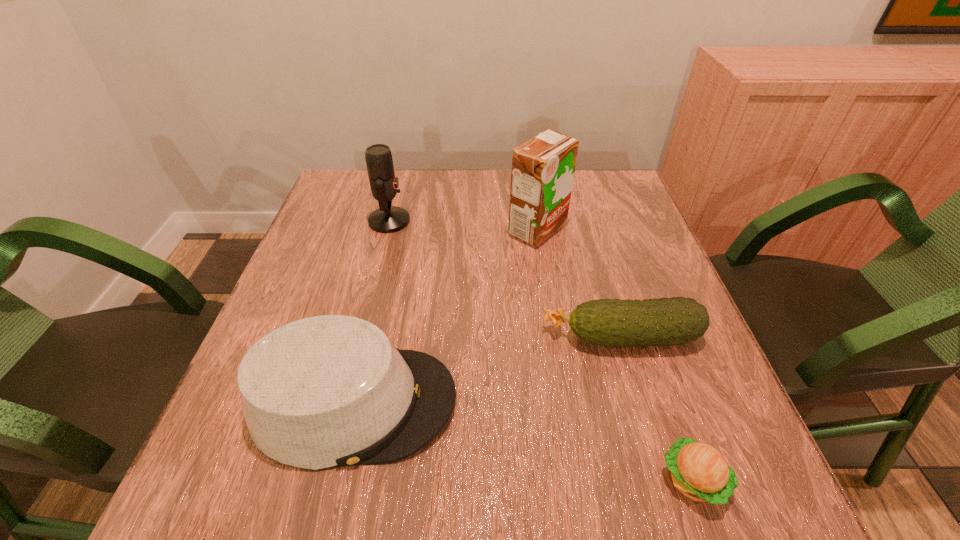
Where is `free spot between the hat and the carton`? Image resolution: width=960 pixels, height=540 pixels. free spot between the hat and the carton is located at coordinates (445, 316).

Locate an element on the screen. This screenshot has height=540, width=960. object that is the fourth closest to the third tallest object is located at coordinates (387, 219).

Locate an element on the screen. This screenshot has width=960, height=540. the third closest object to the microphone is located at coordinates coord(667,321).

Locate an element on the screen. The width and height of the screenshot is (960, 540). vacant region that satisfies the following two spatial constraints: 1. at the blossom end of the hamburger; 2. on the right side of the fourth tallest object is located at coordinates (665, 480).

Where is `free space that satisfies the following two spatial constraints: 1. on the side of the second tallest object with the red ring; 2. on the back side of the hamburger`? The height and width of the screenshot is (540, 960). free space that satisfies the following two spatial constraints: 1. on the side of the second tallest object with the red ring; 2. on the back side of the hamburger is located at coordinates (324, 480).

Image resolution: width=960 pixels, height=540 pixels. In order to click on vacant point that satisfies the following two spatial constraints: 1. on the front-facing side of the hat; 2. on the right side of the shortest object in this screenshot , I will do `click(336, 480)`.

Locate an element on the screen. free region that satisfies the following two spatial constraints: 1. on the side of the shortest object with the red ring; 2. on the left side of the fourth shortest object is located at coordinates (324, 480).

This screenshot has width=960, height=540. Find the location of `free location that satisfies the following two spatial constraints: 1. at the blossom end of the cucumber; 2. on the right side of the shortest object`. free location that satisfies the following two spatial constraints: 1. at the blossom end of the cucumber; 2. on the right side of the shortest object is located at coordinates [x=665, y=480].

Locate an element on the screen. The width and height of the screenshot is (960, 540). vacant region that satisfies the following two spatial constraints: 1. at the blossom end of the hamburger; 2. on the left side of the cucumber is located at coordinates (665, 480).